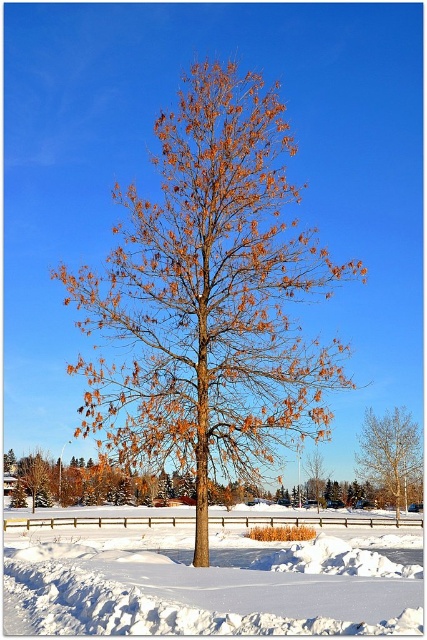
Question: Which of these objects is positioned closest to the golden-brown bark tree at center?

Choices:
 (A) white fluffy snow at center
 (B) brown matte tree at center

Answer: (A)

Question: Which object is the closest to the golden-brown bark tree at center?

Choices:
 (A) white fluffy snow at center
 (B) brown matte tree at center

Answer: (A)

Question: Does brown matte tree at center lie in front of golden-brown bark tree at center?

Choices:
 (A) no
 (B) yes

Answer: (B)

Question: Which point is farther to the camera?

Choices:
 (A) golden-brown bark tree at center
 (B) brown matte tree at center
 (C) white fluffy snow at center

Answer: (A)

Question: Does brown matte tree at center appear on the left side of white fluffy snow at center?

Choices:
 (A) yes
 (B) no

Answer: (B)

Question: Is brown matte tree at center to the left of golden-brown bark tree at center from the viewer's perspective?

Choices:
 (A) yes
 (B) no

Answer: (A)